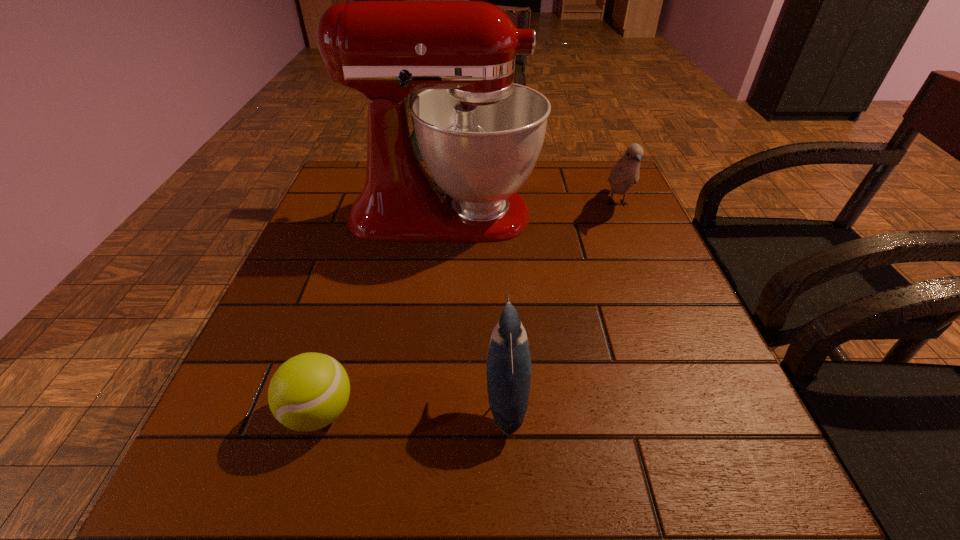
Identify the location of mixer. (480, 134).

In order to click on the rightmost object in this screenshot , I will do `click(625, 173)`.

You are a GUI agent. You are given a task and a screenshot of the screen. Output one action in this format:
    pyautogui.click(x=<x>, y=<y>)
    Task: Click on the right bird
    
    Given the screenshot: What is the action you would take?
    pyautogui.click(x=625, y=173)

Where is `the left bird`? the left bird is located at coordinates (508, 359).

This screenshot has height=540, width=960. Identify the location of the shortest object. (309, 391).

Where is `vacant space situated 0.240m at the attachment hub of the mixer`? The image size is (960, 540). vacant space situated 0.240m at the attachment hub of the mixer is located at coordinates point(637,214).

Image resolution: width=960 pixels, height=540 pixels. What are the coordinates of `vacant space situated 0.320m at the beak of the farther bird` in the screenshot? It's located at (666, 322).

Where is `free space located at the tip of the left bird's beak`? free space located at the tip of the left bird's beak is located at coordinates (353, 398).

Identify the location of vacant area located at the tip of the left bird's beak. (265, 398).

Identify the location of vacant space located at the tip of the left bird's beak. (372, 398).